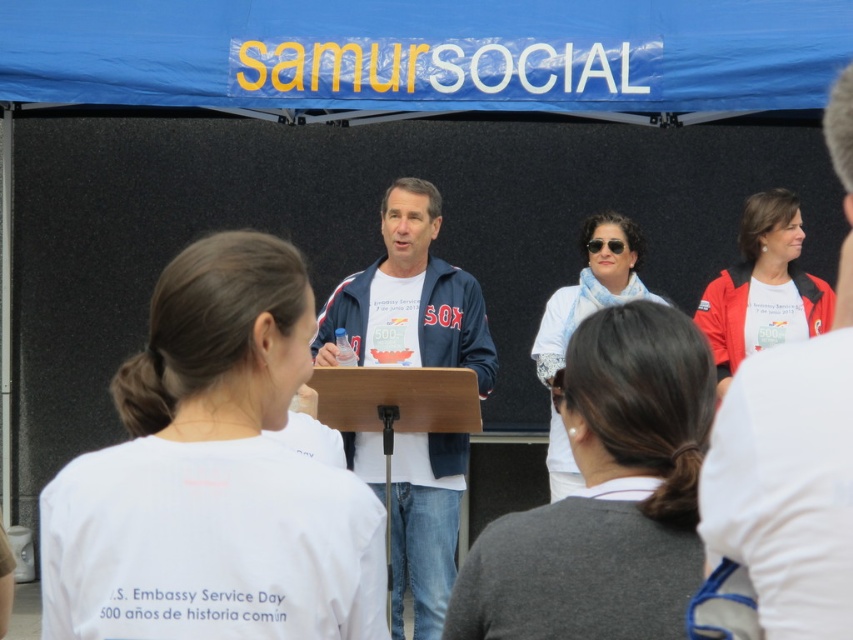
Is gray sweater at center above white scarf at center?

Incorrect, gray sweater at center is not positioned above white scarf at center.

Is point (467, 582) closer to viewer compared to point (547, 332)?

Yes, point (467, 582) is in front of point (547, 332).

What do you see at coordinates (605, 496) in the screenshot?
I see `gray sweater at center` at bounding box center [605, 496].

Identify the location of gray sweater at center. This screenshot has width=853, height=640. (605, 496).

Between white cotton t-shirt at center and gray sweater at center, which one is positioned lower?

gray sweater at center

Is point (213, 422) more distant than point (566, 557)?

Yes, it is.

Locate an element on the screen. The width and height of the screenshot is (853, 640). white cotton t-shirt at center is located at coordinates (213, 476).

Who is higher up, white cotton t-shirt at center or matte blue jacket at center?

matte blue jacket at center

Does point (149, 556) lie in front of point (821, 472)?

No, (149, 556) is behind (821, 472).

Who is more forward, (215, 554) or (845, 90)?

Point (845, 90) is more forward.

At what (x,y) coordinates should I click in order to perform the action: click on white cotton t-shirt at center. Please return your answer as a coordinate pair (x, y). Looking at the image, I should click on (213, 476).